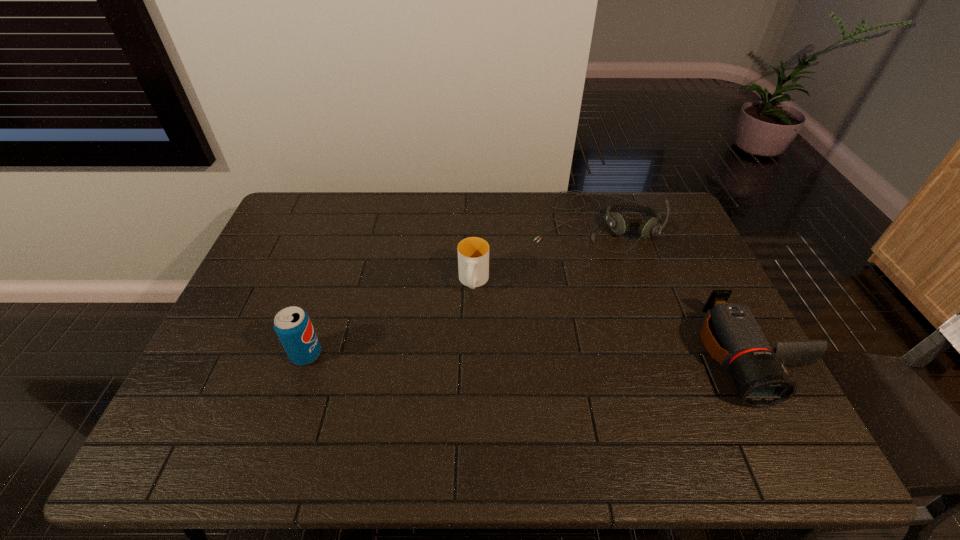
At what (x,y) coordinates should I click in order to perform the action: click on empty space that is in between the leftmost object and the camcorder. Please return your answer as a coordinate pair (x, y). Looking at the image, I should click on (528, 355).

The width and height of the screenshot is (960, 540). I want to click on unoccupied area between the second object from left to right and the camcorder, so click(612, 319).

The image size is (960, 540). In order to click on free spot between the cup and the tallest object in this screenshot , I will do `click(390, 319)`.

Select which object is the closest to the second object from left to right. Please provide its 2D coordinates. Your answer should be formatted as a tuple, i.e. [(x, y)], where the tuple contains the x and y coordinates of a point satisfying the conditions above.

[(618, 222)]

Locate an element on the screen. The width and height of the screenshot is (960, 540). object that stands as the closest to the second object from left to right is located at coordinates (618, 222).

This screenshot has height=540, width=960. I want to click on free space that satisfies the following two spatial constraints: 1. on the back side of the third nearest object; 2. on the right side of the headset, so click(x=474, y=220).

Identify the location of free point that satisfies the following two spatial constraints: 1. on the back side of the soda can; 2. on the left side of the second farthest object. (330, 282).

Where is `free space that satisfies the following two spatial constraints: 1. on the back side of the cup; 2. on the right side of the tallest object`? The height and width of the screenshot is (540, 960). free space that satisfies the following two spatial constraints: 1. on the back side of the cup; 2. on the right side of the tallest object is located at coordinates (330, 282).